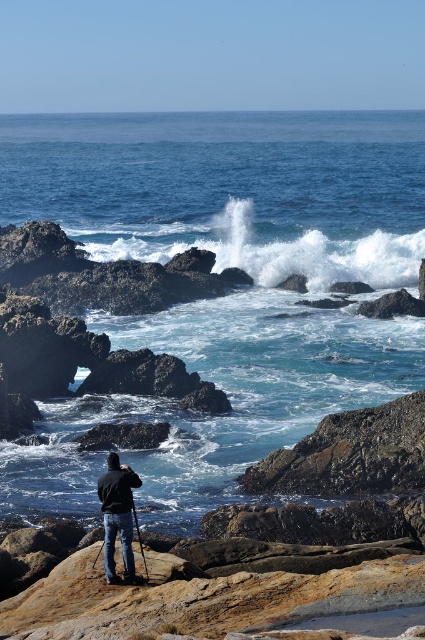
What do you see at coordinates (266, 243) in the screenshot?
I see `white frothy wave at center` at bounding box center [266, 243].

Which is in front, point (192, 218) or point (121, 532)?

Positioned in front is point (121, 532).

Is point (286, 240) in front of point (107, 538)?

No.

The image size is (425, 640). I want to click on white frothy wave at center, so click(x=266, y=243).

Does point (248, 365) come closer to viewer compared to point (107, 465)?

No, (248, 365) is behind (107, 465).

Is blue water at center thinner than black matte jacket at center?

No.

Identify the location of blue water at center. (227, 294).

Consider the image. Can you confirm if blue water at center is smaller than white frothy wave at center?

Actually, blue water at center might be larger than white frothy wave at center.

Describe the element at coordinates (227, 294) in the screenshot. Image resolution: width=425 pixels, height=640 pixels. I see `blue water at center` at that location.

I want to click on blue water at center, so click(x=227, y=294).

The width and height of the screenshot is (425, 640). I want to click on blue water at center, so click(x=227, y=294).